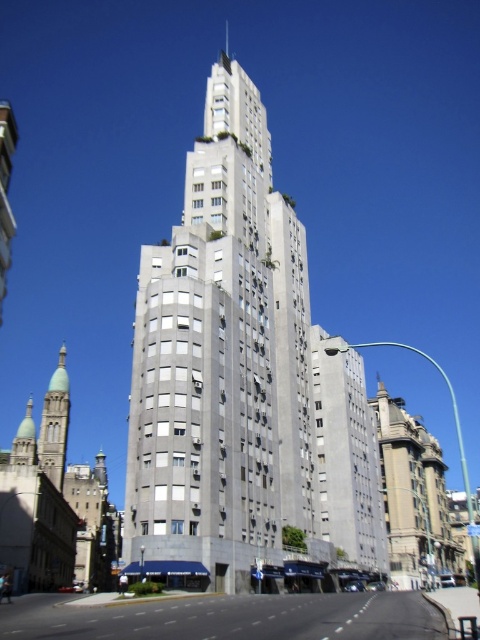
Question: Does gray concrete building at center appear on the right side of green stone minaret at left?

Choices:
 (A) yes
 (B) no

Answer: (A)

Question: Is gray concrete building at center smaller than green stone minaret at left?

Choices:
 (A) yes
 (B) no

Answer: (B)

Question: Among these points, which one is nearest to the camera?

Choices:
 (A) (48, 416)
 (B) (229, 355)

Answer: (B)

Question: Does gray concrete building at center have a smaller size compared to green stone minaret at left?

Choices:
 (A) yes
 (B) no

Answer: (B)

Question: Which object appears farthest from the camera in this image?

Choices:
 (A) gray concrete building at center
 (B) green stone minaret at left

Answer: (B)